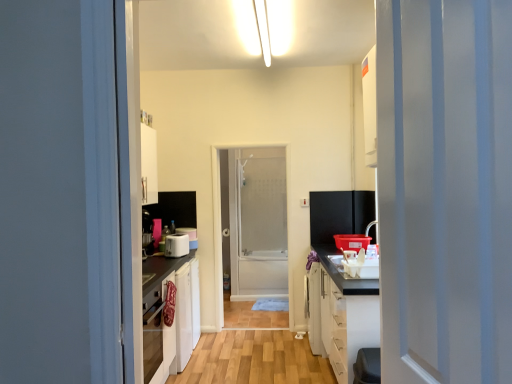
This screenshot has width=512, height=384. Describe the element at coordinates (445, 189) in the screenshot. I see `white glossy door at right` at that location.

Locate an element on the screen. white plastic toaster at center, arranged as the first appliance when viewed from the front is located at coordinates (176, 245).

Find the location of a particular element. The height and width of the screenshot is (384, 512). white plastic electric outlet at center is located at coordinates (304, 203).

What do you see at coordinates (188, 232) in the screenshot? I see `white plastic toaster at center, which is counted as the 1th appliance, starting from the back` at bounding box center [188, 232].

What do you see at coordinates (258, 221) in the screenshot?
I see `frosted glass screen door at center` at bounding box center [258, 221].

Where is `white glossy door at right`? This screenshot has width=512, height=384. white glossy door at right is located at coordinates (445, 189).

Between white plastic toaster at center, which ranks as the 2th appliance in back-to-front order, and white glossy door at right, which one appears on the right side from the viewer's perspective?

Positioned to the right is white glossy door at right.

From the picture: Considering their positions, is white plastic toaster at center, which ranks as the 2th appliance in back-to-front order, located in front of or behind white glossy door at right?

Visually, white plastic toaster at center, which ranks as the 2th appliance in back-to-front order, is located behind white glossy door at right.

Is white plastic toaster at center, which ranks as the 2th appliance in back-to-front order, facing towards white glossy door at right?

No.

What's the angular difference between white plastic toaster at center, arranged as the first appliance when viewed from the front, and white glossy door at right's facing directions?

The facing directions of white plastic toaster at center, arranged as the first appliance when viewed from the front, and white glossy door at right are 157 degrees apart.

Could you tell me if white matte cabinet at right is facing white plastic toaster at center, arranged as the first appliance when viewed from the front?

Yes, white matte cabinet at right is aimed at white plastic toaster at center, arranged as the first appliance when viewed from the front.

Is white matte cabinet at right positioned far away from white plastic toaster at center, which ranks as the 2th appliance in back-to-front order?

white matte cabinet at right is far away from white plastic toaster at center, which ranks as the 2th appliance in back-to-front order.

Is white matte cabinet at right to the right of white plastic toaster at center, which ranks as the 2th appliance in back-to-front order, from the viewer's perspective?

Yes, white matte cabinet at right is to the right of white plastic toaster at center, which ranks as the 2th appliance in back-to-front order.

In the image, is white plastic toaster at center, which is counted as the 1th appliance, starting from the back, positioned in front of or behind frosted glass screen door at center?

white plastic toaster at center, which is counted as the 1th appliance, starting from the back, is in front of frosted glass screen door at center.

Is white plastic toaster at center, which is counted as the 1th appliance, starting from the back, located outside frosted glass screen door at center?

white plastic toaster at center, which is counted as the 1th appliance, starting from the back, is positioned outside frosted glass screen door at center.

From their relative heights in the image, would you say white plastic toaster at center, which is the 2th appliance in front-to-back order, is taller or shorter than frosted glass screen door at center?

In the image, white plastic toaster at center, which is the 2th appliance in front-to-back order, appears to be shorter than frosted glass screen door at center.

Which of these two, white plastic toaster at center, which is the 2th appliance in front-to-back order, or frosted glass screen door at center, is wider?

white plastic toaster at center, which is the 2th appliance in front-to-back order.

Which of these two, frosted glass screen door at center or white plastic toaster at center, which ranks as the 2th appliance in back-to-front order, stands shorter?

white plastic toaster at center, which ranks as the 2th appliance in back-to-front order.

Considering the sizes of frosted glass screen door at center and white plastic toaster at center, arranged as the first appliance when viewed from the front, in the image, is frosted glass screen door at center bigger or smaller than white plastic toaster at center, arranged as the first appliance when viewed from the front,?

In the image, frosted glass screen door at center appears to be larger than white plastic toaster at center, arranged as the first appliance when viewed from the front.

Is frosted glass screen door at center further to camera compared to white plastic toaster at center, which ranks as the 2th appliance in back-to-front order?

Yes, frosted glass screen door at center is further from the viewer.

From a real-world perspective, who is located higher, frosted glass screen door at center or white plastic toaster at center, which ranks as the 2th appliance in back-to-front order?

frosted glass screen door at center.

Is frosted glass screen door at center surrounded by white glossy door at right?

No, frosted glass screen door at center is not a part of white glossy door at right.

Looking at the image, does white glossy door at right seem bigger or smaller compared to frosted glass screen door at center?

Considering their sizes, white glossy door at right takes up less space than frosted glass screen door at center.

From the image's perspective, between white glossy door at right and frosted glass screen door at center, who is located below?

frosted glass screen door at center, from the image's perspective.

Consider the image. From the image's perspective, is white glossy door at right located above or below white plastic toaster at center, which is counted as the 1th appliance, starting from the back?

Clearly, from the image's perspective, white glossy door at right is above white plastic toaster at center, which is counted as the 1th appliance, starting from the back.

From a real-world perspective, who is located higher, white glossy door at right or white plastic toaster at center, which is the 2th appliance in front-to-back order?

In real-world perspective, white glossy door at right is above.

Who is smaller, white glossy door at right or white plastic toaster at center, which is counted as the 1th appliance, starting from the back?

white plastic toaster at center, which is counted as the 1th appliance, starting from the back, is smaller.

Is white glossy door at right touching white plastic toaster at center, which is the 2th appliance in front-to-back order?

white glossy door at right and white plastic toaster at center, which is the 2th appliance in front-to-back order, are clearly separated.

Is point (193, 238) closer or farther from the camera than point (333, 361)?

Clearly, point (193, 238) is more distant from the camera than point (333, 361).

Is white plastic toaster at center, which is counted as the 1th appliance, starting from the back, taller or shorter than white matte cabinet at right?

white plastic toaster at center, which is counted as the 1th appliance, starting from the back, is shorter than white matte cabinet at right.

Is white plastic toaster at center, which is the 2th appliance in front-to-back order, wider than white matte cabinet at right?

No, white plastic toaster at center, which is the 2th appliance in front-to-back order, is not wider than white matte cabinet at right.

What's the angular difference between white plastic toaster at center, which is the 2th appliance in front-to-back order, and white matte cabinet at right's facing directions?

151 degrees separate the facing orientations of white plastic toaster at center, which is the 2th appliance in front-to-back order, and white matte cabinet at right.

Identify the location of the 2nd appliance positioned below the white glossy door at right (from the image's perspective). (176, 245).

The height and width of the screenshot is (384, 512). Find the location of `cabinetry to the right of white plastic toaster at center, which ranks as the 2th appliance in back-to-front order`. cabinetry to the right of white plastic toaster at center, which ranks as the 2th appliance in back-to-front order is located at coordinates (341, 313).

From the image, which object appears to be nearer to frosted glass screen door at center, white glossy door at right or white matte cabinet at right?

white matte cabinet at right is closer to frosted glass screen door at center.

Looking at the image, which one is located further to white glossy door at right, white plastic toaster at center, which is counted as the 1th appliance, starting from the back, or wooden floor at center?

white plastic toaster at center, which is counted as the 1th appliance, starting from the back.

Based on their spatial positions, is white plastic toaster at center, which is counted as the 1th appliance, starting from the back, or white glossy door at right closer to white matte cabinet at right?

white plastic toaster at center, which is counted as the 1th appliance, starting from the back, lies closer to white matte cabinet at right than the other object.

Looking at the image, which one is located closer to white matte cabinet at right, white plastic toaster at center, which ranks as the 2th appliance in back-to-front order, or wooden floor at center?

wooden floor at center is closer to white matte cabinet at right.

When comparing their distances from white plastic toaster at center, which is counted as the 1th appliance, starting from the back, does white plastic electric outlet at center or white plastic toaster at center, which ranks as the 2th appliance in back-to-front order, seem further?

white plastic electric outlet at center.

Looking at the image, which one is located further to frosted glass screen door at center, white matte cabinet at right or white glossy door at right?

white glossy door at right is positioned further to the anchor frosted glass screen door at center.

Based on their spatial positions, is white glossy door at right or white plastic toaster at center, which is counted as the 1th appliance, starting from the back, closer to wooden floor at center?

white plastic toaster at center, which is counted as the 1th appliance, starting from the back, is positioned closer to the anchor wooden floor at center.

Based on their spatial positions, is white matte cabinet at right or white glossy door at right further from white plastic electric outlet at center?

white glossy door at right.

Image resolution: width=512 pixels, height=384 pixels. Identify the location of screen door located between white plastic toaster at center, which is counted as the 1th appliance, starting from the back, and white matte cabinet at right in the left-right direction. (258, 221).

Where is `appliance between white plastic toaster at center, arranged as the first appliance when viewed from the front, and white plastic electric outlet at center, in the horizontal direction`? Image resolution: width=512 pixels, height=384 pixels. appliance between white plastic toaster at center, arranged as the first appliance when viewed from the front, and white plastic electric outlet at center, in the horizontal direction is located at coordinates (188, 232).

This screenshot has height=384, width=512. In order to click on appliance situated between white plastic toaster at center, arranged as the first appliance when viewed from the front, and frosted glass screen door at center from left to right in this screenshot , I will do `click(188, 232)`.

The image size is (512, 384). I want to click on electric outlet positioned between white glossy door at right and frosted glass screen door at center from near to far, so click(x=304, y=203).